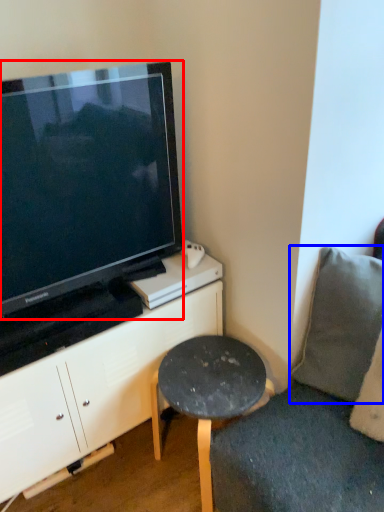
Question: Among these objects, which one is farthest to the camera, television (highlighted by a red box) or pillow (highlighted by a blue box)?

Choices:
 (A) television
 (B) pillow

Answer: (B)